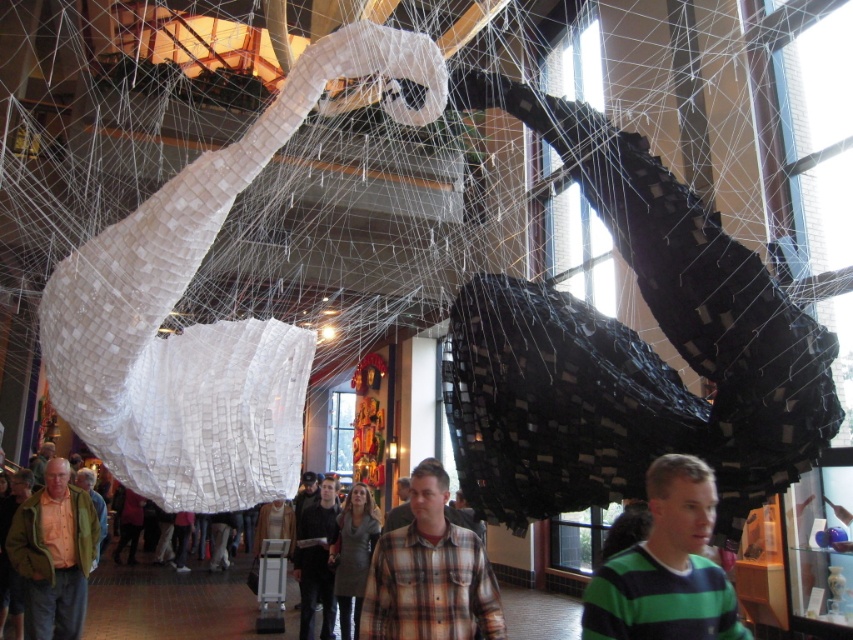
Can you confirm if green striped sweater at center is smaller than dark gray fabric jacket at center?

Yes.

Looking at this image, is green striped sweater at center to the left of dark gray fabric jacket at center from the viewer's perspective?

No, green striped sweater at center is not to the left of dark gray fabric jacket at center.

Which is behind, point (654, 616) or point (305, 609)?

Point (305, 609)

Identify the location of green striped sweater at center. (666, 566).

Who is positioned more to the right, light brown leather jacket at lower left or green textured jacket at center?

From the viewer's perspective, light brown leather jacket at lower left appears more on the right side.

Is light brown leather jacket at lower left positioned at the back of green textured jacket at center?

No, it is in front of green textured jacket at center.

The height and width of the screenshot is (640, 853). I want to click on light brown leather jacket at lower left, so click(53, 554).

Locate an element on the screen. Image resolution: width=853 pixels, height=640 pixels. light brown leather jacket at lower left is located at coordinates (53, 554).

The width and height of the screenshot is (853, 640). What do you see at coordinates (430, 573) in the screenshot? I see `plaid shirt at center` at bounding box center [430, 573].

Is point (380, 593) positioned behind point (100, 525)?

No, (380, 593) is closer to viewer.

Identify the location of plaid shirt at center. coord(430,573).